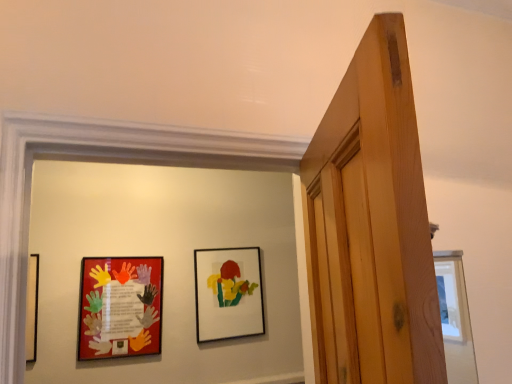
Question: In terms of size, does matte black picture frame at center, the 2th picture frame from the front, appear bigger or smaller than matte plastic picture frame at left, which is counted as the second picture frame, starting from the right?

Choices:
 (A) big
 (B) small

Answer: (A)

Question: From the image's perspective, is matte black picture frame at center, placed as the 2th picture frame when sorted from left to right, located above or below matte plastic picture frame at left, the 1th picture frame positioned from the left?

Choices:
 (A) below
 (B) above

Answer: (B)

Question: Is matte black picture frame at center, placed as the 2th picture frame when sorted from left to right, wider or thinner than matte plastic picture frame at left, the first picture frame in the front-to-back sequence?

Choices:
 (A) thin
 (B) wide

Answer: (B)

Question: Is point (97, 334) positioned closer to the camera than point (202, 331)?

Choices:
 (A) farther
 (B) closer

Answer: (B)

Question: Looking at the image, does matte plastic picture frame at left, the 1th picture frame positioned from the left, seem bigger or smaller compared to matte black picture frame at center, marked as the 1th picture frame in a back-to-front arrangement?

Choices:
 (A) small
 (B) big

Answer: (A)

Question: Visually, is matte plastic picture frame at left, which ranks as the 2th picture frame in back-to-front order, positioned to the left or to the right of matte black picture frame at center, arranged as the first picture frame when viewed from the right?

Choices:
 (A) left
 (B) right

Answer: (A)

Question: From their relative heights in the image, would you say matte plastic picture frame at left, which is counted as the second picture frame, starting from the right, is taller or shorter than matte black picture frame at center, the 2th picture frame from the front?

Choices:
 (A) tall
 (B) short

Answer: (B)